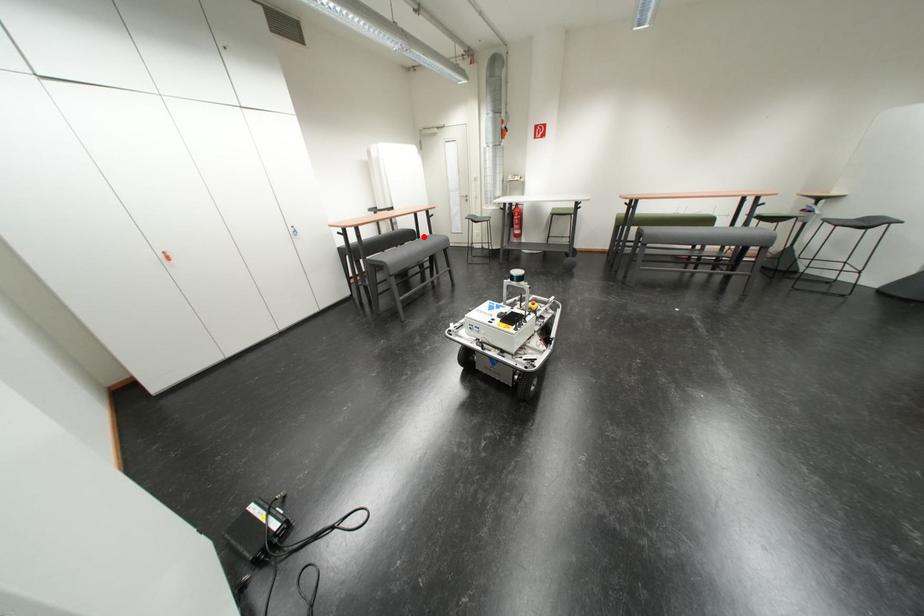
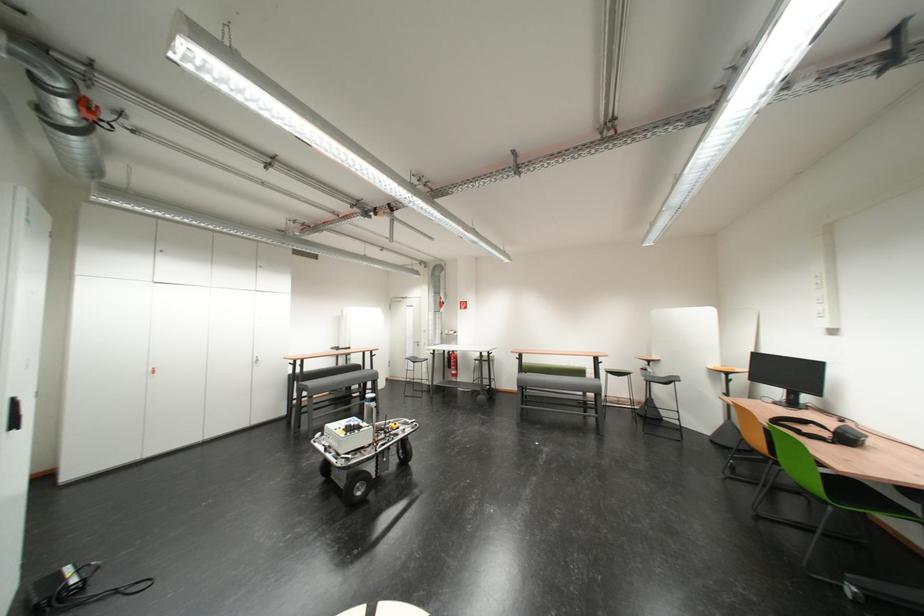
Question: I am providing you with two images of the same scene from different viewpoints. A red point is shown in image1. For the corresponding object point in image2, is it positioned nearer or farther from the camera?

Choices:
 (A) Nearer
 (B) Farther

Answer: (A)